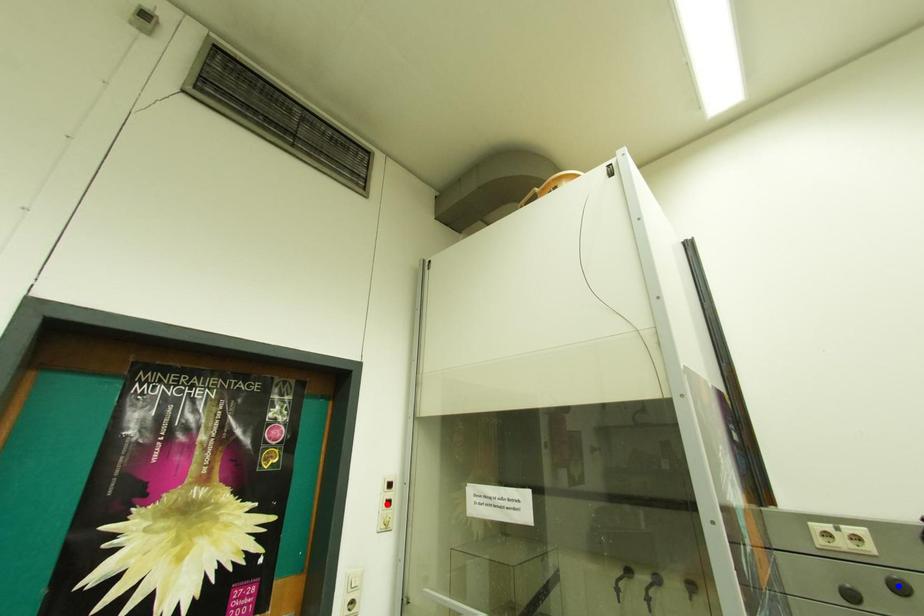
Question: Which of the two points in the image is closer to the camera?

Choices:
 (A) Blue point is closer.
 (B) Red point is closer.

Answer: (A)